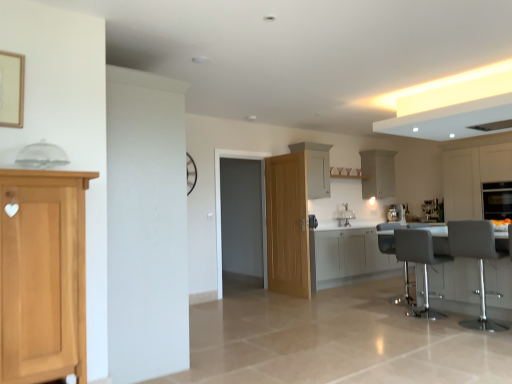
Question: Is white matte cabinet at upper right, marked as the fifth cabinetry in a front-to-back arrangement, in front of satin silver coffee machine at center, which ranks as the 1th coffee machine in left-to-right order?

Choices:
 (A) no
 (B) yes

Answer: (B)

Question: From the image's perspective, would you say white matte cabinet at upper right, arranged as the fourth cabinetry when viewed from the left, is positioned over satin silver coffee machine at center, which appears as the second coffee machine when viewed from the right?

Choices:
 (A) no
 (B) yes

Answer: (B)

Question: Is white matte cabinet at upper right, marked as the fifth cabinetry in a front-to-back arrangement, to the right of satin silver coffee machine at center, which ranks as the 1th coffee machine in left-to-right order, from the viewer's perspective?

Choices:
 (A) yes
 (B) no

Answer: (B)

Question: Can you confirm if white matte cabinet at upper right, the first cabinetry positioned from the back, is bigger than satin silver coffee machine at center, which ranks as the 1th coffee machine in left-to-right order?

Choices:
 (A) yes
 (B) no

Answer: (A)

Question: Is white matte cabinet at upper right, placed as the second cabinetry when sorted from right to left, thinner than satin silver coffee machine at center, which ranks as the 1th coffee machine in left-to-right order?

Choices:
 (A) yes
 (B) no

Answer: (B)

Question: From the image's perspective, relative to satin silver coffee machine at right, the first coffee machine when ordered from right to left, is white glossy sink at center above or below?

Choices:
 (A) below
 (B) above

Answer: (B)

Question: In terms of size, does white glossy sink at center appear bigger or smaller than satin silver coffee machine at right, positioned as the 2th coffee machine in left-to-right order?

Choices:
 (A) big
 (B) small

Answer: (B)

Question: Is white glossy sink at center wider or thinner than satin silver coffee machine at right, positioned as the 2th coffee machine in left-to-right order?

Choices:
 (A) wide
 (B) thin

Answer: (B)

Question: Considering the positions of point (351, 216) and point (430, 215), is point (351, 216) closer or farther from the camera than point (430, 215)?

Choices:
 (A) closer
 (B) farther

Answer: (A)

Question: Is white matte cabinet at center, which is counted as the 4th cabinetry, starting from the right, in front of or behind satin silver coffee machine at right, the first coffee machine when ordered from right to left, in the image?

Choices:
 (A) front
 (B) behind

Answer: (A)

Question: From the image's perspective, is white matte cabinet at center, which is counted as the 4th cabinetry, starting from the right, above or below satin silver coffee machine at right, positioned as the 2th coffee machine in left-to-right order?

Choices:
 (A) below
 (B) above

Answer: (B)

Question: Is point (328, 165) closer or farther from the camera than point (422, 213)?

Choices:
 (A) closer
 (B) farther

Answer: (A)

Question: From a real-world perspective, is white matte cabinet at center, which appears as the fourth cabinetry when viewed from the front, positioned above or below satin silver coffee machine at right, the first coffee machine when ordered from right to left?

Choices:
 (A) above
 (B) below

Answer: (A)

Question: Considering the positions of point (407, 304) and point (340, 246), is point (407, 304) closer or farther from the camera than point (340, 246)?

Choices:
 (A) closer
 (B) farther

Answer: (A)

Question: Considering the relative positions of gray fabric swivel chair at lower right and white glossy cabinets at center, which appears as the 3th cabinetry when viewed from the left, in the image provided, is gray fabric swivel chair at lower right to the left or to the right of white glossy cabinets at center, which appears as the 3th cabinetry when viewed from the left,?

Choices:
 (A) right
 (B) left

Answer: (A)